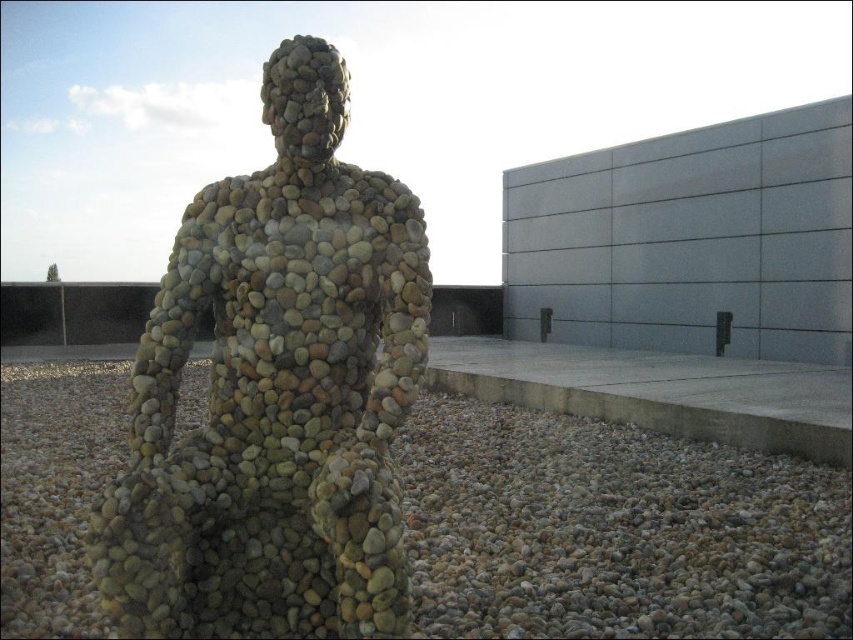
Can you confirm if multicolored pebble sculpture at center is wider than smooth pebbles at center?

In fact, multicolored pebble sculpture at center might be narrower than smooth pebbles at center.

Find the location of a particular element. The height and width of the screenshot is (640, 853). multicolored pebble sculpture at center is located at coordinates (276, 392).

Where is `multicolored pebble sculpture at center`? multicolored pebble sculpture at center is located at coordinates (276, 392).